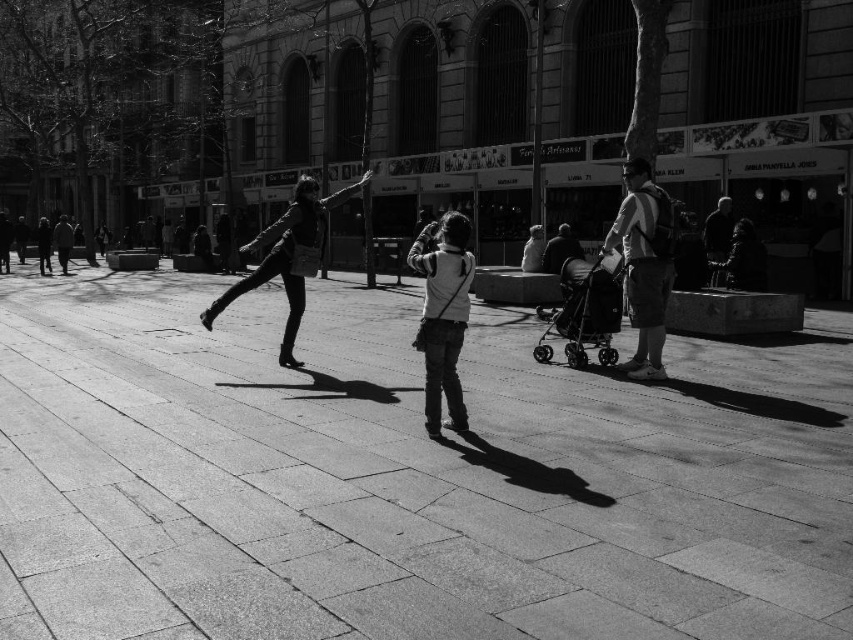
You are a city planner analyzing the photograph of the plaza. The smooth concrete pavement at center and denim pants at center are both visible in the scene. Which of these two objects is wider?

The smooth concrete pavement at center is wider than the denim pants at center.